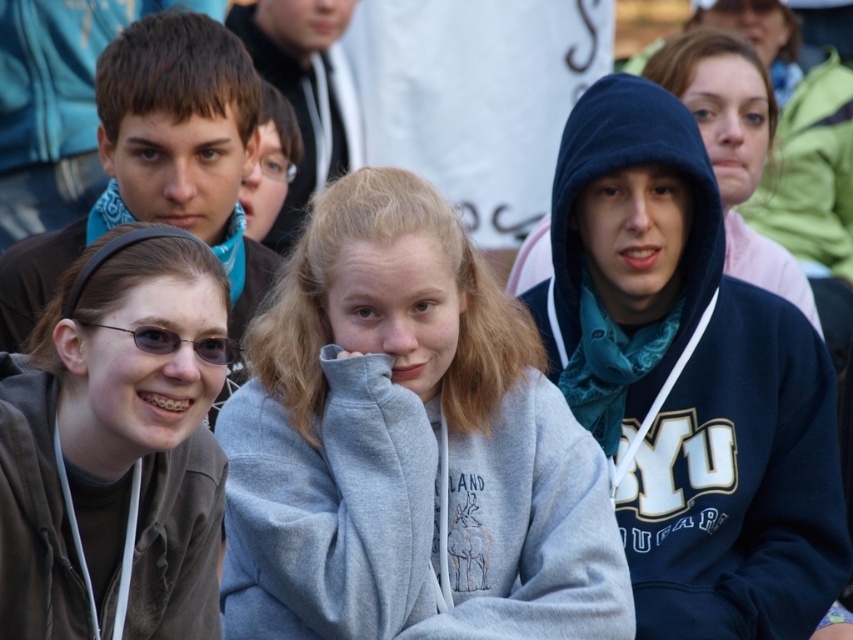
Does gray fleece sweatshirt at center have a larger size compared to black plastic glasses at lower left?

Yes.

Which is more to the left, gray fleece sweatshirt at center or black plastic glasses at lower left?

From the viewer's perspective, black plastic glasses at lower left appears more on the left side.

At what (x,y) coordinates should I click in order to perform the action: click on gray fleece sweatshirt at center. Please return your answer as a coordinate pair (x, y). This screenshot has width=853, height=640. Looking at the image, I should click on (407, 445).

Does matte brown jacket at lower left have a lesser width compared to brown hair at center?

Yes, matte brown jacket at lower left is thinner than brown hair at center.

Image resolution: width=853 pixels, height=640 pixels. I want to click on matte brown jacket at lower left, so click(x=115, y=451).

The width and height of the screenshot is (853, 640). Identify the location of matte brown jacket at lower left. (115, 451).

Between brown hair at center and black plastic glasses at lower left, which one appears on the left side from the viewer's perspective?

brown hair at center is more to the left.

Can you confirm if brown hair at center is positioned to the left of black plastic glasses at lower left?

A: Yes, brown hair at center is to the left of black plastic glasses at lower left.

Between point (221, 154) and point (161, 330), which one is positioned in front?

Point (161, 330)

Identify the location of brown hair at center. tap(160, 163).